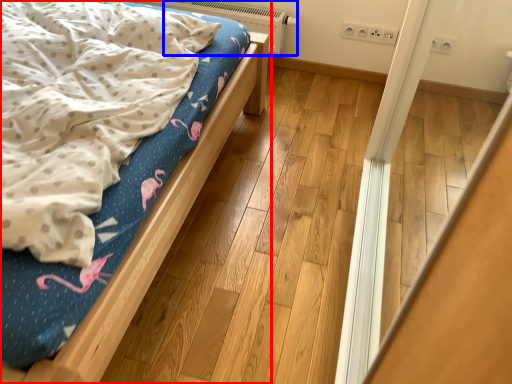
Question: Which of the following is the farthest to the observer, bed (highlighted by a red box) or heater (highlighted by a blue box)?

Choices:
 (A) bed
 (B) heater

Answer: (B)